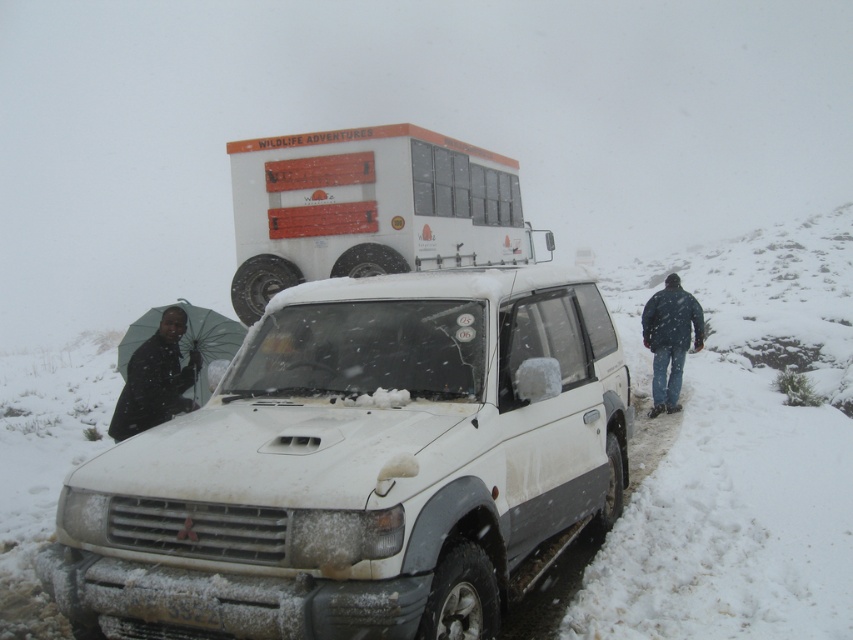
Question: Can you confirm if white matte suv at center is smaller than white matte bus at upper center?

Choices:
 (A) no
 (B) yes

Answer: (A)

Question: Which object is positioned closest to the white matte bus at upper center?

Choices:
 (A) white matte suv at center
 (B) dark blue jeans at right
 (C) black umbrella at left

Answer: (C)

Question: Is the position of white matte suv at center less distant than that of white matte bus at upper center?

Choices:
 (A) yes
 (B) no

Answer: (A)

Question: Based on their relative distances, which object is farther from the dark blue jeans at right?

Choices:
 (A) black umbrella at left
 (B) white matte bus at upper center
 (C) white matte suv at center

Answer: (C)

Question: From the image, what is the correct spatial relationship of black umbrella at left in relation to dark blue jeans at right?

Choices:
 (A) below
 (B) above

Answer: (B)

Question: Which point is closer to the camera?

Choices:
 (A) (360, 209)
 (B) (148, 424)
 (C) (656, 326)
 (D) (281, 484)

Answer: (D)